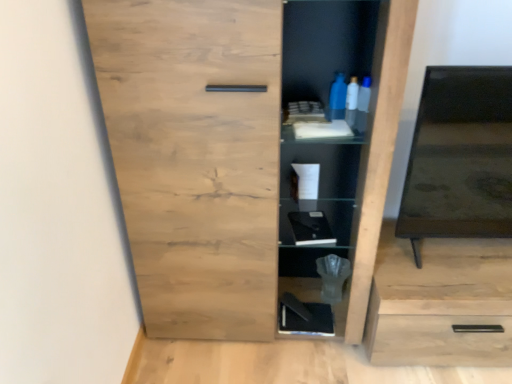
Where is `free point above light wood drawer at lower right (from a real-world perspective)`? The width and height of the screenshot is (512, 384). free point above light wood drawer at lower right (from a real-world perspective) is located at coordinates (444, 266).